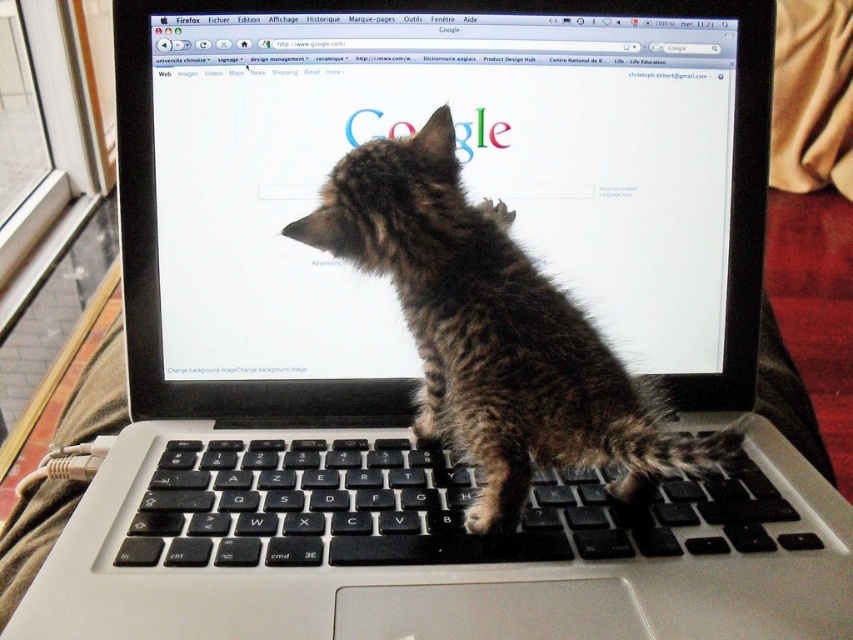
Question: Can you confirm if matte black laptop at center is wider than brown fur kitten at center?

Choices:
 (A) yes
 (B) no

Answer: (A)

Question: From the image, what is the correct spatial relationship of matte black laptop at center in relation to black matte keyboard at center?

Choices:
 (A) below
 (B) above

Answer: (B)

Question: Is matte black laptop at center thinner than black matte keyboard at center?

Choices:
 (A) no
 (B) yes

Answer: (A)

Question: Which of the following is the farthest from the observer?

Choices:
 (A) (372, 364)
 (B) (611, 364)

Answer: (A)

Question: Based on their relative distances, which object is nearer to the black matte keyboard at center?

Choices:
 (A) matte black laptop at center
 (B) brown fur kitten at center

Answer: (B)

Question: Which object is farther from the camera taking this photo?

Choices:
 (A) brown fur kitten at center
 (B) matte black laptop at center

Answer: (B)